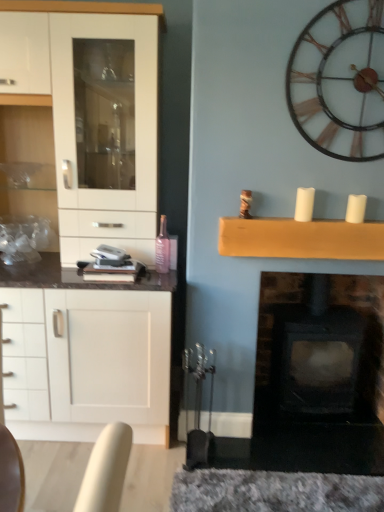
Locate an element on the screen. This screenshot has width=384, height=512. white matte candle at upper right, positioned as the 2th candle in left-to-right order is located at coordinates (356, 208).

Describe the element at coordinates (319, 376) in the screenshot. The height and width of the screenshot is (512, 384). I see `black matte fireplace at center` at that location.

Describe the element at coordinates (162, 247) in the screenshot. I see `pink glass bottle at center` at that location.

Measure the distance between point (330, 87) and camera.

A distance of 1.88 meters exists between point (330, 87) and camera.

This screenshot has width=384, height=512. What do you see at coordinates (340, 80) in the screenshot?
I see `metallic brown clock at upper right` at bounding box center [340, 80].

What are the coordinates of `wooden mantle at upper center` in the screenshot? It's located at (300, 239).

Find the location of a particular element. This screenshot has width=384, height=512. white matte candle at upper right, which appears as the first candle when viewed from the right is located at coordinates (356, 208).

Find the location of `shelf below the white matte candle at upper center, the 1th candle from the left (from a real-world perspective)`. shelf below the white matte candle at upper center, the 1th candle from the left (from a real-world perspective) is located at coordinates (300, 239).

Is point (311, 216) closer or farther from the camera than point (302, 222)?

Point (311, 216) is farther from the camera than point (302, 222).

How different are the orientations of white matte candle at upper center, marked as the second candle in a right-to-left arrangement, and wooden mantle at upper center in degrees?

The angle between the facing direction of white matte candle at upper center, marked as the second candle in a right-to-left arrangement, and the facing direction of wooden mantle at upper center is 0.398 degrees.

Does white matte candle at upper center, marked as the second candle in a right-to-left arrangement, lie behind wooden mantle at upper center?

No, white matte candle at upper center, marked as the second candle in a right-to-left arrangement, is in front of wooden mantle at upper center.

Looking at this image, from the image's perspective, is metallic brown clock at upper right above white matte candle at upper right, which appears as the first candle when viewed from the right?

Correct, metallic brown clock at upper right appears higher than white matte candle at upper right, which appears as the first candle when viewed from the right, in the image.

Could you tell me if metallic brown clock at upper right is facing white matte candle at upper right, positioned as the 2th candle in left-to-right order?

No, metallic brown clock at upper right does not turn towards white matte candle at upper right, positioned as the 2th candle in left-to-right order.

Is metallic brown clock at upper right taller or shorter than white matte candle at upper right, positioned as the 2th candle in left-to-right order?

metallic brown clock at upper right is taller than white matte candle at upper right, positioned as the 2th candle in left-to-right order.

Is black matte fireplace at center inside white matte candle at upper right, which appears as the first candle when viewed from the right?

No.

How different are the orientations of white matte candle at upper right, positioned as the 2th candle in left-to-right order, and black matte fireplace at center in degrees?

They differ by 0.29 degrees in their facing directions.

At what (x,y) coordinates should I click in order to perform the action: click on candle on the right of black matte fireplace at center. Please return your answer as a coordinate pair (x, y). This screenshot has width=384, height=512. Looking at the image, I should click on (356, 208).

Which of these two, white matte candle at upper right, positioned as the 2th candle in left-to-right order, or black matte fireplace at center, is bigger?

With larger size is black matte fireplace at center.

Measure the distance between wooden mantle at upper center and white matte candle at upper center, marked as the second candle in a right-to-left arrangement.

wooden mantle at upper center and white matte candle at upper center, marked as the second candle in a right-to-left arrangement, are 7.30 inches apart from each other.

Is wooden mantle at upper center situated inside white matte candle at upper center, the 1th candle from the left, or outside?

wooden mantle at upper center is not inside white matte candle at upper center, the 1th candle from the left, it's outside.

Who is shorter, wooden mantle at upper center or white matte candle at upper center, the 1th candle from the left?

With less height is white matte candle at upper center, the 1th candle from the left.

From a real-world perspective, which is physically above, wooden mantle at upper center or white matte candle at upper center, the 1th candle from the left?

From a 3D spatial view, white matte candle at upper center, the 1th candle from the left, is above.

Is black matte fireplace at center far from white glossy cabinet at left?

Indeed, black matte fireplace at center is not near white glossy cabinet at left.

Is black matte fireplace at center surrounding white glossy cabinet at left?

Actually, white glossy cabinet at left is outside black matte fireplace at center.

From a real-world perspective, who is located higher, black matte fireplace at center or white glossy cabinet at left?

From a 3D spatial view, white glossy cabinet at left is above.

Based on their sizes in the image, would you say wooden mantle at upper center is bigger or smaller than white glossy cabinet at left?

Considering their sizes, wooden mantle at upper center takes up less space than white glossy cabinet at left.

Is wooden mantle at upper center looking in the opposite direction of white glossy cabinet at left?

No, white glossy cabinet at left is not at the back of wooden mantle at upper center.

Would you consider wooden mantle at upper center to be distant from white glossy cabinet at left?

No.

At what (x,y) coordinates should I click in order to perform the action: click on cabinetry that appears on the left of wooden mantle at upper center. Please return your answer as a coordinate pair (x, y). This screenshot has width=384, height=512. Looking at the image, I should click on (94, 120).

Is pink glass bottle at center inside or outside of black matte fireplace at center?

pink glass bottle at center is not inside black matte fireplace at center, it's outside.

From a real-world perspective, which is physically above, pink glass bottle at center or black matte fireplace at center?

pink glass bottle at center.

From the image's perspective, between pink glass bottle at center and black matte fireplace at center, which one is located above?

pink glass bottle at center appears higher in the image.

The image size is (384, 512). Identify the location of the 2nd candle in front when counting from the wooden mantle at upper center. (304, 204).

Locate an element on the screen. This screenshot has width=384, height=512. wall clock above the white matte candle at upper right, positioned as the 2th candle in left-to-right order (from the image's perspective) is located at coordinates (340, 80).

Consider the image. When comparing their distances from white matte candle at upper right, which appears as the first candle when viewed from the right, does wooden mantle at upper center or metallic brown clock at upper right seem closer?

wooden mantle at upper center.

Based on the photo, when comparing their distances from pink glass bottle at center, does wooden mantle at upper center or white matte candle at upper right, positioned as the 2th candle in left-to-right order, seem closer?

Based on the image, wooden mantle at upper center appears to be nearer to pink glass bottle at center.

From the picture: From the image, which object appears to be nearer to white matte candle at upper center, marked as the second candle in a right-to-left arrangement, white glossy cabinet at left or pink glass bottle at center?

pink glass bottle at center.

Looking at the image, which one is located further to white glossy cabinet at left, white matte candle at upper right, positioned as the 2th candle in left-to-right order, or white matte candle at upper center, the 1th candle from the left?

Based on the image, white matte candle at upper right, positioned as the 2th candle in left-to-right order, appears to be further to white glossy cabinet at left.

When comparing their distances from pink glass bottle at center, does white glossy cabinet at left or white matte candle at upper center, marked as the second candle in a right-to-left arrangement, seem further?

Based on the image, white matte candle at upper center, marked as the second candle in a right-to-left arrangement, appears to be further to pink glass bottle at center.

Which object lies nearer to the anchor point white matte candle at upper center, the 1th candle from the left, wooden mantle at upper center or black matte fireplace at center?

wooden mantle at upper center.

Considering their positions, is white matte candle at upper right, which appears as the first candle when viewed from the right, positioned closer to black matte fireplace at center than white glossy cabinet at left?

white matte candle at upper right, which appears as the first candle when viewed from the right, is positioned closer to the anchor black matte fireplace at center.

Which object lies nearer to the anchor point white matte candle at upper center, marked as the second candle in a right-to-left arrangement, pink glass bottle at center or black matte fireplace at center?

Based on the image, pink glass bottle at center appears to be nearer to white matte candle at upper center, marked as the second candle in a right-to-left arrangement.

What are the coordinates of `shelf between pink glass bottle at center and white matte candle at upper right, positioned as the 2th candle in left-to-right order` in the screenshot? It's located at (300, 239).

I want to click on candle between pink glass bottle at center and white matte candle at upper right, positioned as the 2th candle in left-to-right order, so click(304, 204).

The height and width of the screenshot is (512, 384). Identify the location of wall clock between white glossy cabinet at left and white matte candle at upper right, which appears as the first candle when viewed from the right, from left to right. (340, 80).

The image size is (384, 512). Identify the location of shelf located between white matte candle at upper center, marked as the second candle in a right-to-left arrangement, and white matte candle at upper right, positioned as the 2th candle in left-to-right order, in the left-right direction. (300, 239).